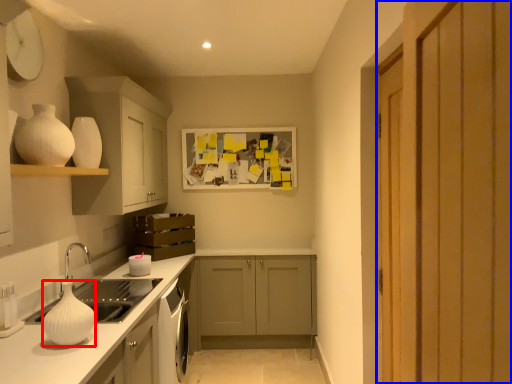
Question: Which object is closer to the camera taking this photo, vase (highlighted by a red box) or door (highlighted by a blue box)?

Choices:
 (A) vase
 (B) door

Answer: (B)